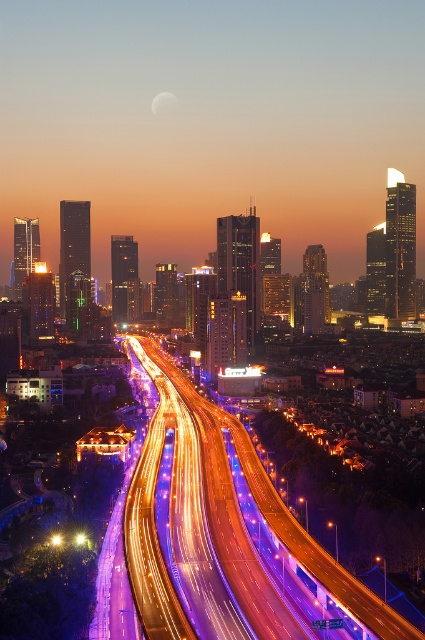
Between purple light trails at center and silvery reflective moon at upper center, which one is positioned higher?

Positioned higher is silvery reflective moon at upper center.

Is point (220, 593) more distant than point (167, 97)?

No, (220, 593) is in front of (167, 97).

Who is more distant from viewer, [238,432] or [169,96]?

The point [169,96] is behind.

This screenshot has width=425, height=640. In order to click on purple light trails at center in this screenshot , I will do `click(226, 536)`.